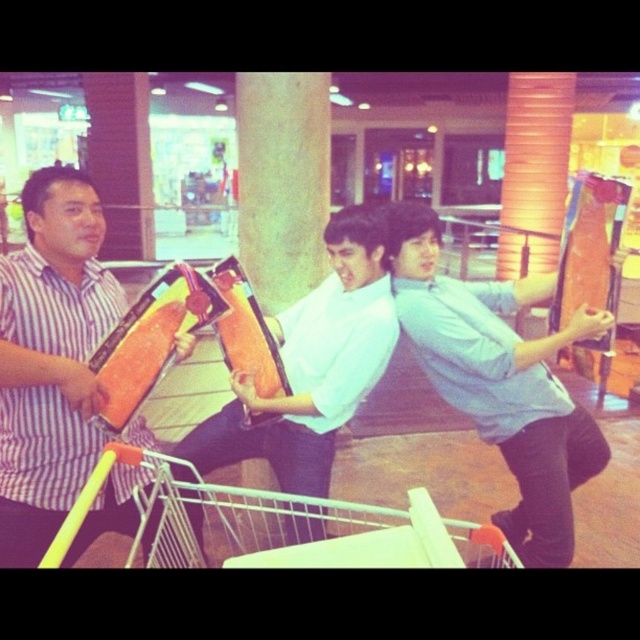
Question: Is matte striped shirt at left further to the viewer compared to white metal shopping cart at lower left?

Choices:
 (A) yes
 (B) no

Answer: (A)

Question: Is matte striped shirt at left smaller than white metal shopping cart at lower left?

Choices:
 (A) no
 (B) yes

Answer: (B)

Question: Which point is closer to the camera?

Choices:
 (A) light blue shirt at center
 (B) white metal shopping cart at lower left

Answer: (B)

Question: Which point is closer to the camera?

Choices:
 (A) matte striped shirt at left
 (B) light blue shirt at center
 (C) white matte skateboard at center

Answer: (A)

Question: Is matte striped shirt at left to the left of white matte skateboard at center from the viewer's perspective?

Choices:
 (A) yes
 (B) no

Answer: (A)

Question: Which of the following is the farthest from the observer?

Choices:
 (A) (452, 566)
 (B) (500, 323)
 (C) (314, 477)
 (D) (13, 438)

Answer: (B)